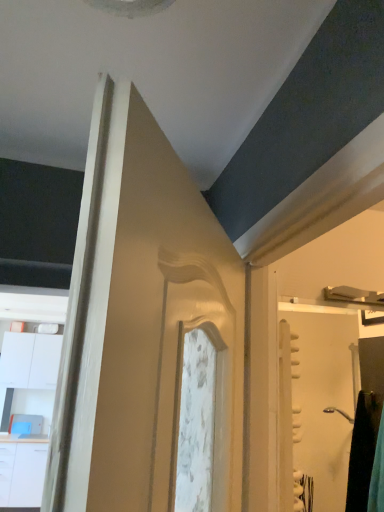
Question: Is white glossy drawer at lower left in contact with white glossy cabinet at left?

Choices:
 (A) no
 (B) yes

Answer: (A)

Question: Does white glossy drawer at lower left have a larger size compared to white glossy cabinet at left?

Choices:
 (A) yes
 (B) no

Answer: (B)

Question: Can you confirm if white glossy drawer at lower left is smaller than white glossy cabinet at left?

Choices:
 (A) yes
 (B) no

Answer: (A)

Question: Is white glossy drawer at lower left not near white glossy cabinet at left?

Choices:
 (A) no
 (B) yes

Answer: (A)

Question: From a real-world perspective, is white glossy drawer at lower left positioned under white glossy cabinet at left based on gravity?

Choices:
 (A) yes
 (B) no

Answer: (A)

Question: From the image's perspective, relative to white glossy screen door at right, is white glossy cabinet at left above or below?

Choices:
 (A) below
 (B) above

Answer: (A)

Question: From a real-world perspective, relative to white glossy screen door at right, is white glossy cabinet at left vertically above or below?

Choices:
 (A) above
 (B) below

Answer: (B)

Question: Considering the positions of point (28, 358) and point (291, 314), is point (28, 358) closer or farther from the camera than point (291, 314)?

Choices:
 (A) closer
 (B) farther

Answer: (A)

Question: In terms of height, does white glossy cabinet at left look taller or shorter compared to white glossy screen door at right?

Choices:
 (A) tall
 (B) short

Answer: (A)

Question: Based on their sizes in the image, would you say white glossy drawer at lower left is bigger or smaller than white glossy cabinet at left?

Choices:
 (A) big
 (B) small

Answer: (B)

Question: In terms of width, does white glossy drawer at lower left look wider or thinner when compared to white glossy cabinet at left?

Choices:
 (A) thin
 (B) wide

Answer: (A)

Question: In the image, is white glossy drawer at lower left positioned in front of or behind white glossy cabinet at left?

Choices:
 (A) front
 (B) behind

Answer: (A)

Question: From the image's perspective, is white glossy drawer at lower left located above or below white glossy cabinet at left?

Choices:
 (A) above
 (B) below

Answer: (B)

Question: Is point (3, 489) closer or farther from the camera than point (354, 322)?

Choices:
 (A) farther
 (B) closer

Answer: (B)

Question: Considering their positions, is white glossy drawer at lower left located in front of or behind white glossy screen door at right?

Choices:
 (A) behind
 (B) front

Answer: (A)